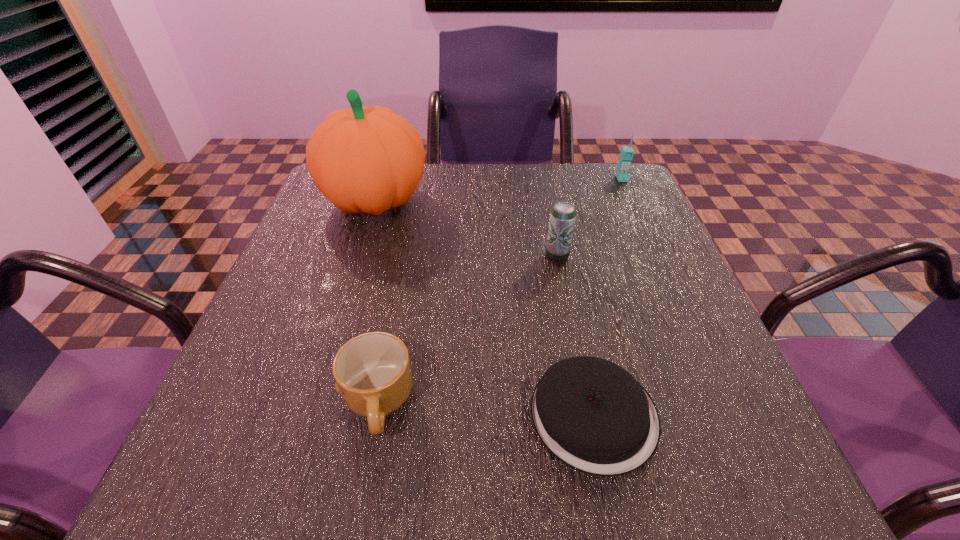
Image resolution: width=960 pixels, height=540 pixels. Identify the location of free space at the near edge of the desktop. (368, 445).

This screenshot has height=540, width=960. I want to click on vacant space at the left edge of the desktop, so click(269, 396).

Identify the location of vacant space at the right edge of the desktop. (716, 346).

Locate an element on the screen. Image resolution: width=960 pixels, height=540 pixels. free location at the near left corner is located at coordinates (194, 480).

Find the location of a particular element. free space between the pumpkin and the third nearest object is located at coordinates (467, 228).

Image resolution: width=960 pixels, height=540 pixels. In order to click on free space between the mug and the rightmost object in this screenshot , I will do `click(499, 291)`.

Locate an element on the screen. The image size is (960, 540). free spot between the rightmost object and the fourth tallest object is located at coordinates (499, 291).

Where is `free space between the beer can and the mug`? This screenshot has width=960, height=540. free space between the beer can and the mug is located at coordinates (468, 330).

I want to click on free spot between the beer can and the rightmost object, so click(x=589, y=218).

Locate an element on the screen. free space that is in between the beer can and the second shortest object is located at coordinates (468, 330).